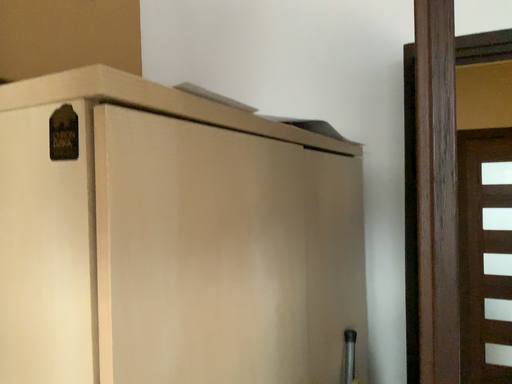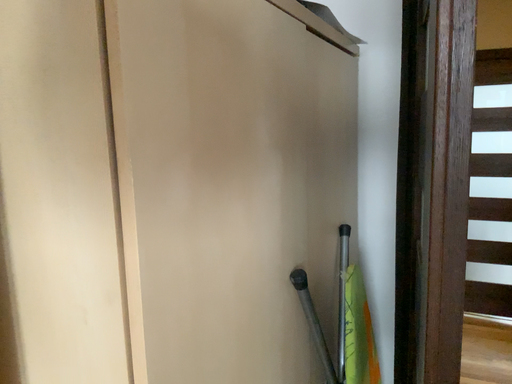
Question: How did the camera likely rotate when shooting the video?

Choices:
 (A) rotated upward
 (B) rotated downward

Answer: (B)